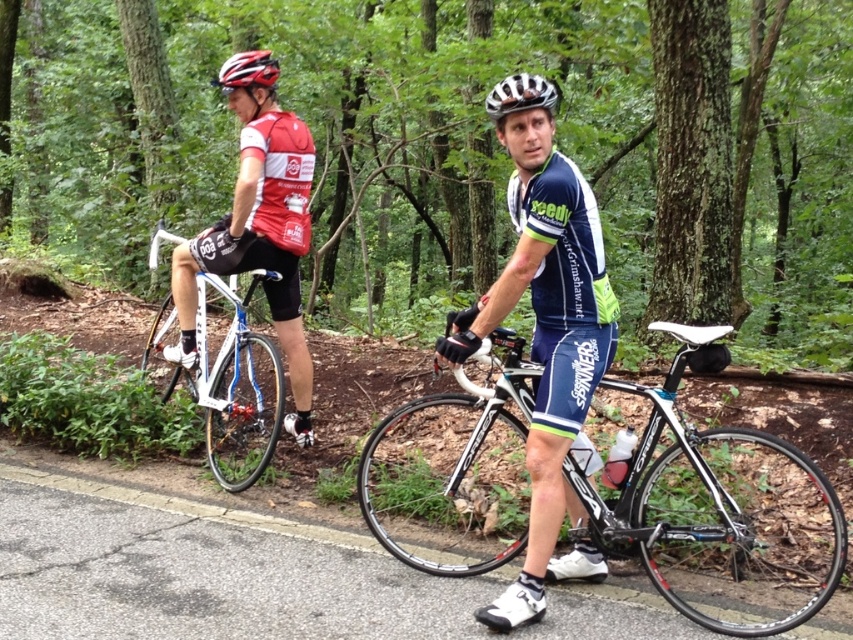
Who is higher up, shiny black frame at center or blue/white jersey at center?

blue/white jersey at center is above.

The image size is (853, 640). Describe the element at coordinates (718, 515) in the screenshot. I see `shiny black frame at center` at that location.

Identify the location of shiny black frame at center. (718, 515).

Measure the distance between shiny black frame at center and shiny multicolored helmet at upper center.

shiny black frame at center is 7.80 feet from shiny multicolored helmet at upper center.

Who is more distant from viewer, (509, 330) or (268, 80)?

Positioned behind is point (268, 80).

The height and width of the screenshot is (640, 853). I want to click on shiny black frame at center, so click(718, 515).

Which is below, blue/white jersey at center or white matte helmet at center?

blue/white jersey at center is below.

Can you confirm if blue/white jersey at center is positioned above white matte helmet at center?

Incorrect, blue/white jersey at center is not positioned above white matte helmet at center.

Who is more distant from viewer, (x=614, y=305) or (x=544, y=83)?

The point (x=614, y=305) is behind.

Where is `blue/white jersey at center`? blue/white jersey at center is located at coordinates (547, 346).